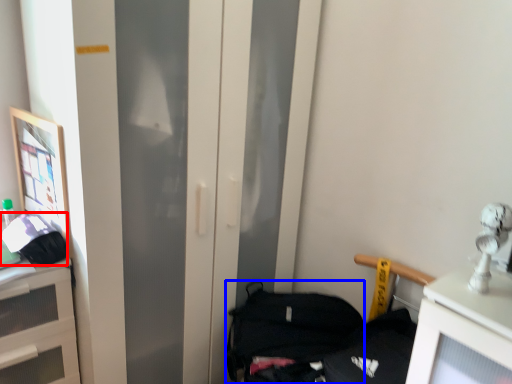
Question: Which object is further to the camera taking this photo, handbag (highlighted by a red box) or handbag (highlighted by a blue box)?

Choices:
 (A) handbag
 (B) handbag

Answer: (B)